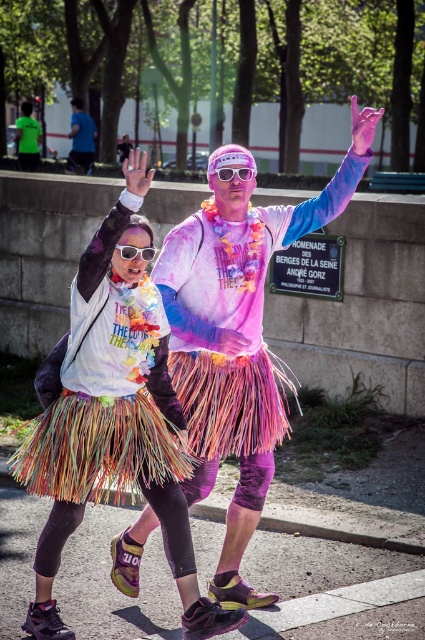
Does point (269, 598) lie behind point (22, 113)?

No, it is not.

Which is more to the left, multicolored tie-dye shirt at center or matte green t-shirt at upper left?

Positioned to the left is matte green t-shirt at upper left.

Where is `multicolored tie-dye shirt at center`? The width and height of the screenshot is (425, 640). multicolored tie-dye shirt at center is located at coordinates (238, 336).

The height and width of the screenshot is (640, 425). I want to click on multicolored tie-dye shirt at center, so click(x=238, y=336).

From the picture: Who is more distant from viewer, (235, 172) or (149, 260)?

The point (235, 172) is behind.

Is pink plastic goggles at center bigger than clear plastic goggles at upper center?

No, pink plastic goggles at center is not bigger than clear plastic goggles at upper center.

You are a GUI agent. You are given a task and a screenshot of the screen. Output one action in this format:
    pyautogui.click(x=<x>, y=<y>)
    Task: Click on the pink plastic goggles at center
    
    Given the screenshot: What is the action you would take?
    pyautogui.click(x=234, y=172)

Locate an element on the screen. pink plastic goggles at center is located at coordinates pos(234,172).

Does rainbow grass skirt at center appear over matte green t-shirt at upper left?

No, rainbow grass skirt at center is not above matte green t-shirt at upper left.

Who is positioned more to the left, rainbow grass skirt at center or matte green t-shirt at upper left?

matte green t-shirt at upper left

This screenshot has height=640, width=425. I want to click on rainbow grass skirt at center, so click(x=121, y=401).

Locate an element on the screen. This screenshot has height=640, width=425. rainbow grass skirt at center is located at coordinates (121, 401).